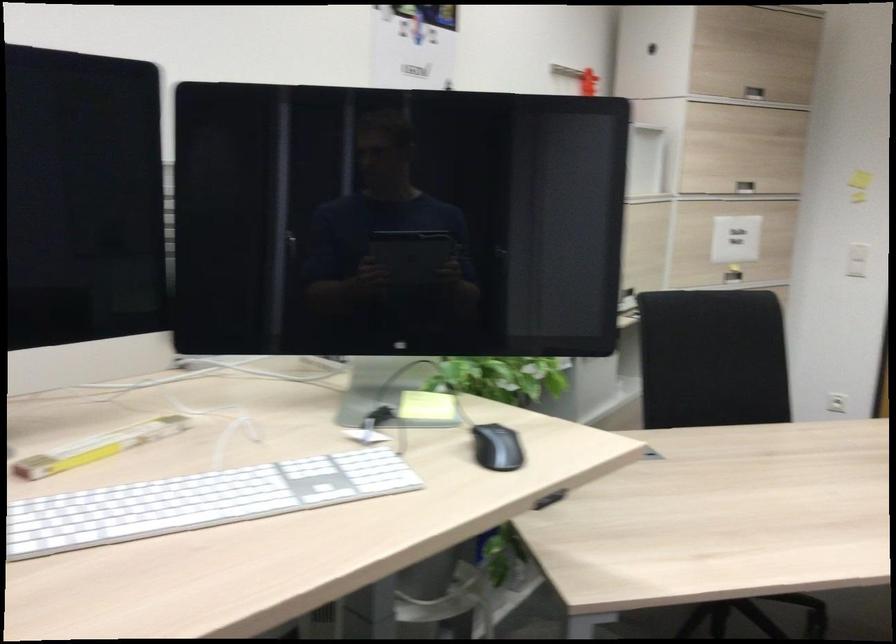
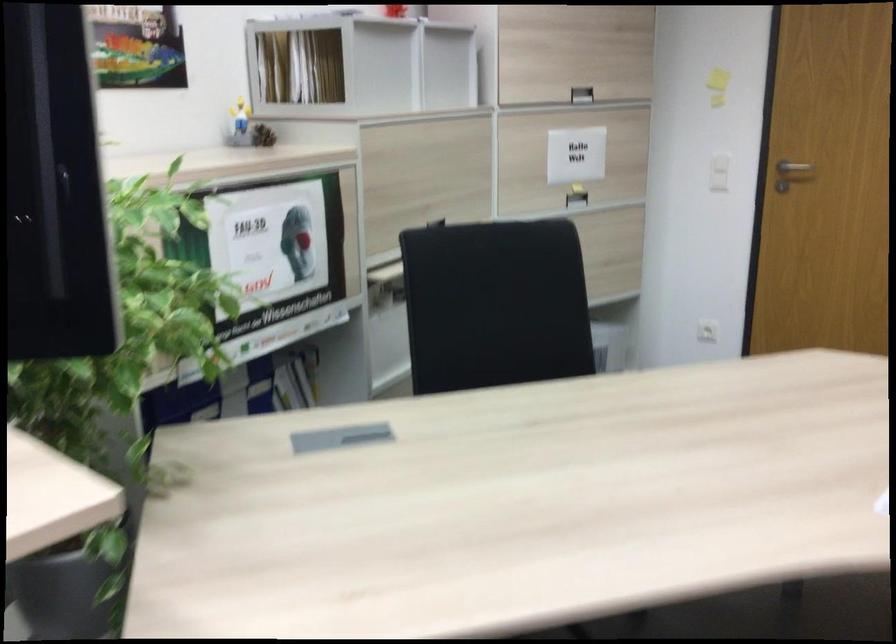
The images are taken continuously from a first-person perspective. In which direction are you moving?

The cameraman moved toward right, forward.